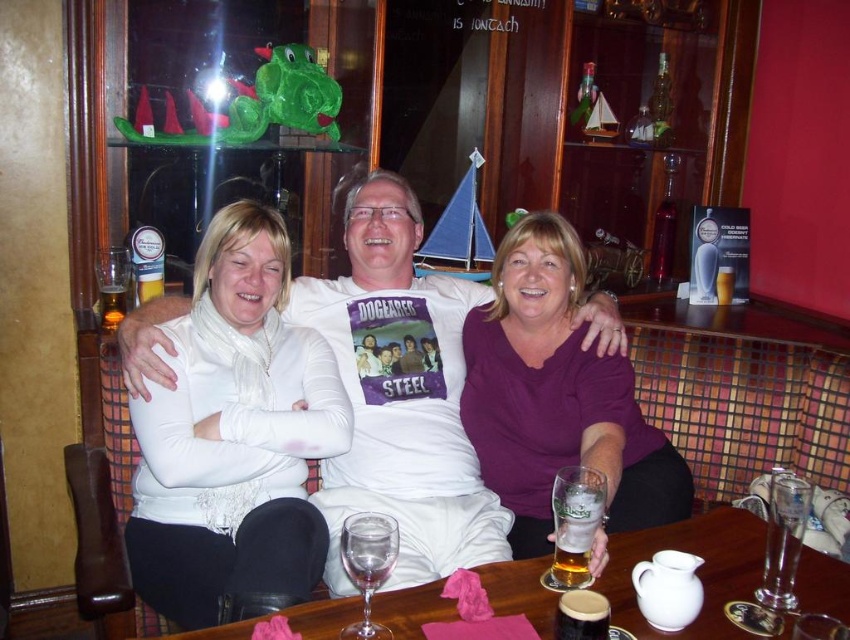
Does white matte scarf at upper left have a lesser width compared to translucent glass beer at center?

No.

Is point (295, 516) in front of point (571, 561)?

No.

At what (x,y) coordinates should I click in order to perform the action: click on white matte scarf at upper left. Please return your answer as a coordinate pair (x, y). This screenshot has width=850, height=640. Looking at the image, I should click on (234, 435).

Between purple matte shirt at center and translucent glass wine at center, which one is positioned higher?

Positioned higher is purple matte shirt at center.

Does purple matte shirt at center appear on the right side of translucent glass wine at center?

Correct, you'll find purple matte shirt at center to the right of translucent glass wine at center.

This screenshot has width=850, height=640. What do you see at coordinates (557, 396) in the screenshot? I see `purple matte shirt at center` at bounding box center [557, 396].

The width and height of the screenshot is (850, 640). In order to click on purple matte shirt at center in this screenshot , I will do [x=557, y=396].

Who is higher up, translucent glass wine at center or translucent glass beer at center?

translucent glass beer at center is higher up.

Is translucent glass wine at center above translucent glass beer at center?

Actually, translucent glass wine at center is below translucent glass beer at center.

Is point (246, 628) more distant than point (588, 554)?

No, it is in front of (588, 554).

The width and height of the screenshot is (850, 640). I want to click on translucent glass wine at center, so click(697, 572).